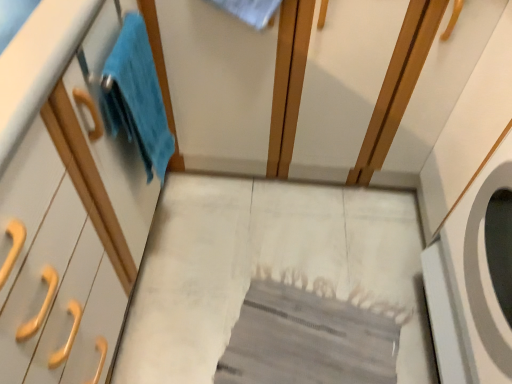
You are a GUI agent. You are given a task and a screenshot of the screen. Output one action in this format:
    pyautogui.click(x=<x>, y=<y>)
    Task: Click on the white matte cabinet at left
    This screenshot has height=384, width=512.
    Given the screenshot: What is the action you would take?
    pyautogui.click(x=65, y=200)

What do you see at coordinates (65, 200) in the screenshot? I see `white matte cabinet at left` at bounding box center [65, 200].

In order to face white matte cabinet at left, should I rotate leftwards or rightwards?

It's best to rotate left around 25.986 degrees.

Locate an element on the screen. The height and width of the screenshot is (384, 512). blue fluffy towel at left is located at coordinates (136, 97).

Describe the element at coordinates (136, 97) in the screenshot. I see `blue fluffy towel at left` at that location.

Identify the location of white matte cabinet at left. pyautogui.click(x=65, y=200).

Which object is positioned more to the right, blue fluffy towel at left or white matte cabinet at left?

blue fluffy towel at left is more to the right.

Between blue fluffy towel at left and white matte cabinet at left, which one is positioned in front?

white matte cabinet at left is closer to the camera.

Considering the positions of point (114, 88) and point (11, 160), is point (114, 88) closer or farther from the camera than point (11, 160)?

Clearly, point (114, 88) is more distant from the camera than point (11, 160).

From the image's perspective, is blue fluffy towel at left below white matte cabinet at left?

Actually, blue fluffy towel at left appears above white matte cabinet at left in the image.

From a real-world perspective, between blue fluffy towel at left and white matte cabinet at left, who is vertically lower?

white matte cabinet at left, from a real-world perspective.

Between blue fluffy towel at left and white matte cabinet at left, which one has larger width?

Wider between the two is white matte cabinet at left.

In terms of height, does blue fluffy towel at left look taller or shorter compared to white matte cabinet at left?

Considering their sizes, blue fluffy towel at left has less height than white matte cabinet at left.

Looking at this image, can you confirm if blue fluffy towel at left is bigger than white matte cabinet at left?

No.

Would you say white matte cabinet at left is part of blue fluffy towel at left's contents?

No, white matte cabinet at left is not a part of blue fluffy towel at left.

Is there a large distance between blue fluffy towel at left and white matte cabinet at left?

Actually, blue fluffy towel at left and white matte cabinet at left are a little close together.

Could you tell me if blue fluffy towel at left is turned towards white matte cabinet at left?

No, blue fluffy towel at left is not aimed at white matte cabinet at left.

What's the angular difference between blue fluffy towel at left and white matte cabinet at left's facing directions?

The angle between the facing direction of blue fluffy towel at left and the facing direction of white matte cabinet at left is 0.239 degrees.

I want to click on cabinetry that is below the blue fluffy towel at left (from the image's perspective), so 65,200.

Considering the relative positions of white matte cabinet at left and blue fluffy towel at left in the image provided, is white matte cabinet at left to the left or to the right of blue fluffy towel at left?

Clearly, white matte cabinet at left is on the left of blue fluffy towel at left in the image.

Considering the positions of objects white matte cabinet at left and blue fluffy towel at left in the image provided, who is in front, white matte cabinet at left or blue fluffy towel at left?

white matte cabinet at left is closer to the camera.

Which is closer to the camera, [67,167] or [162,163]?

Point [67,167] is positioned closer to the camera compared to point [162,163].

From the image's perspective, is white matte cabinet at left located above blue fluffy towel at left?

No.

From a real-world perspective, is white matte cabinet at left located higher than blue fluffy towel at left?

No, from a real-world perspective, white matte cabinet at left is not over blue fluffy towel at left

Consider the image. Which object is thinner, white matte cabinet at left or blue fluffy towel at left?

Thinner between the two is blue fluffy towel at left.

Consider the image. Can you confirm if white matte cabinet at left is shorter than blue fluffy towel at left?

In fact, white matte cabinet at left may be taller than blue fluffy towel at left.

Considering the relative sizes of white matte cabinet at left and blue fluffy towel at left in the image provided, is white matte cabinet at left bigger than blue fluffy towel at left?

Indeed, white matte cabinet at left has a larger size compared to blue fluffy towel at left.

Would you say white matte cabinet at left is outside blue fluffy towel at left?

Yes, white matte cabinet at left is not within blue fluffy towel at left.

Is white matte cabinet at left positioned far away from blue fluffy towel at left?

No.

Is white matte cabinet at left oriented towards blue fluffy towel at left?

Yes, white matte cabinet at left faces towards blue fluffy towel at left.

In the scene shown: How different are the orientations of white matte cabinet at left and blue fluffy towel at left in degrees?

0.239 degrees separate the facing orientations of white matte cabinet at left and blue fluffy towel at left.

At what (x,y) coordinates should I click in order to perform the action: click on cabinetry lying below the blue fluffy towel at left (from the image's perspective). Please return your answer as a coordinate pair (x, y). The width and height of the screenshot is (512, 384). Looking at the image, I should click on (65, 200).

The width and height of the screenshot is (512, 384). Find the location of `cabinetry that appears in front of the blue fluffy towel at left`. cabinetry that appears in front of the blue fluffy towel at left is located at coordinates (65, 200).

Where is `bath towel above the white matte cabinet at left (from a real-world perspective)`? The height and width of the screenshot is (384, 512). bath towel above the white matte cabinet at left (from a real-world perspective) is located at coordinates (136, 97).